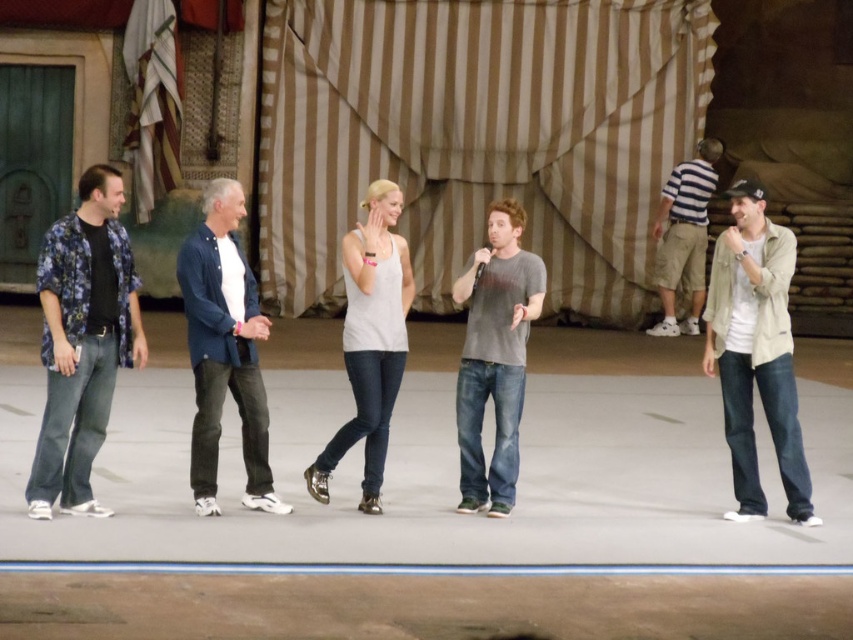
Is point (347, 371) behind point (672, 317)?

No.

In the scene shown: Who is higher up, white matte tank top at center or striped shirt at right?

striped shirt at right is above.

What do you see at coordinates (370, 340) in the screenshot?
I see `white matte tank top at center` at bounding box center [370, 340].

Find the location of a particular element. The height and width of the screenshot is (640, 853). white matte tank top at center is located at coordinates (370, 340).

Is point (488, 308) closer to camera compared to point (384, 451)?

Yes, point (488, 308) is closer to viewer.

Which is above, gray cotton t-shirt at center or white matte tank top at center?

white matte tank top at center is higher up.

Where is `gray cotton t-shirt at center`? gray cotton t-shirt at center is located at coordinates (495, 356).

Which is in front, point (241, 358) or point (672, 170)?

Point (241, 358) is more forward.

Does blue denim shirt at center appear on the left side of striped shirt at right?

Yes, blue denim shirt at center is to the left of striped shirt at right.

The image size is (853, 640). Find the location of `blue denim shirt at center`. blue denim shirt at center is located at coordinates (224, 349).